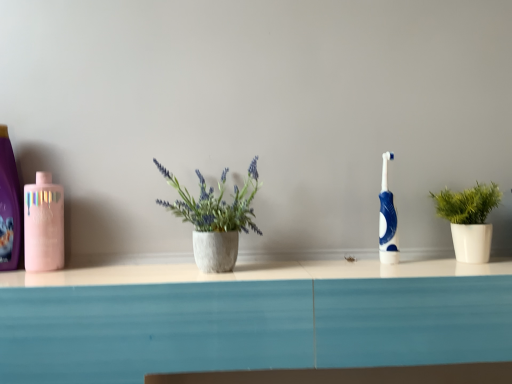
Question: Is pink glossy mouthwash at left located outside matte pink bottle at left?

Choices:
 (A) yes
 (B) no

Answer: (A)

Question: From the image's perspective, is pink glossy mouthwash at left located above matte pink bottle at left?

Choices:
 (A) yes
 (B) no

Answer: (B)

Question: Is pink glossy mouthwash at left surrounding matte pink bottle at left?

Choices:
 (A) yes
 (B) no

Answer: (B)

Question: Does pink glossy mouthwash at left come behind matte pink bottle at left?

Choices:
 (A) yes
 (B) no

Answer: (B)

Question: From the image's perspective, does pink glossy mouthwash at left appear lower than matte pink bottle at left?

Choices:
 (A) yes
 (B) no

Answer: (A)

Question: From a real-world perspective, does pink glossy mouthwash at left sit lower than matte pink bottle at left?

Choices:
 (A) yes
 (B) no

Answer: (A)

Question: From a real-world perspective, is pink glossy mouthwash at left under white matte plant pot at right?

Choices:
 (A) yes
 (B) no

Answer: (B)

Question: Does pink glossy mouthwash at left come in front of white matte plant pot at right?

Choices:
 (A) yes
 (B) no

Answer: (B)

Question: Is pink glossy mouthwash at left positioned with its back to white matte plant pot at right?

Choices:
 (A) yes
 (B) no

Answer: (B)

Question: Considering the relative sizes of pink glossy mouthwash at left and white matte plant pot at right in the image provided, is pink glossy mouthwash at left bigger than white matte plant pot at right?

Choices:
 (A) yes
 (B) no

Answer: (B)

Question: From the image's perspective, is pink glossy mouthwash at left under white matte plant pot at right?

Choices:
 (A) no
 (B) yes

Answer: (A)

Question: Is pink glossy mouthwash at left at the left side of white matte plant pot at right?

Choices:
 (A) yes
 (B) no

Answer: (A)

Question: Is white matte plant pot at right bigger than pink glossy mouthwash at left?

Choices:
 (A) yes
 (B) no

Answer: (A)